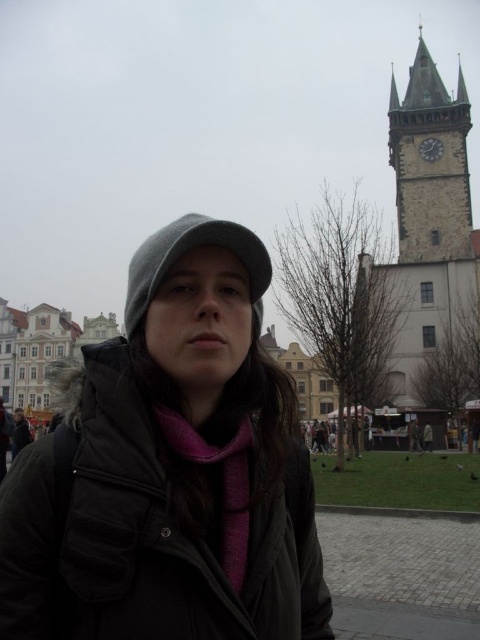
From the picture: You are a tourist in the European town square and want to take a photo of the stone clock tower at upper right. You notice the matte gray beanie at center is blocking your view. Which direction should you move to get the tower in frame without the beanie?

Move to the right side of the matte gray beanie at center so that the stone clock tower at upper right comes into view without obstruction.

You are a fashion designer observing a person in a European town square. You notice the matte gray beanie at center and the purple soft scarf at center. How far apart are these two accessories from each other?

The matte gray beanie at center and the purple soft scarf at center are 19.07 feet apart from each other.

You are a tourist in a European town square and want to take a photo of the historic stone tower with its clock face. You notice a specific point marked at coordinates point (430, 163). Where is this point located in relation to the tower?

The point (430, 163) is located on the stone clock tower at upper right.